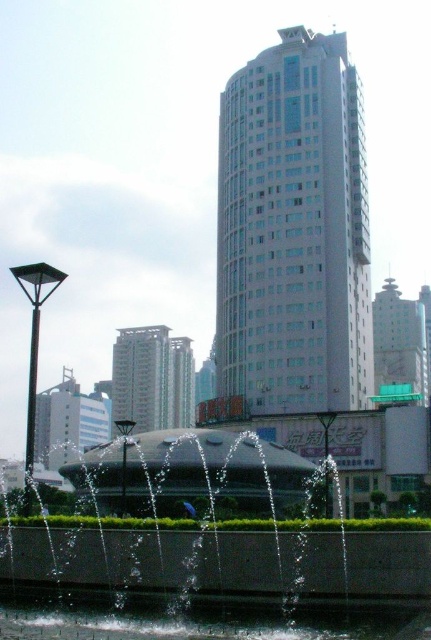
Is the position of concrete fountain at center more distant than that of clear water at fountain center?

No.

Is concrete fountain at center above clear water at fountain center?

Indeed, concrete fountain at center is positioned over clear water at fountain center.

The width and height of the screenshot is (431, 640). I want to click on concrete fountain at center, so click(x=181, y=541).